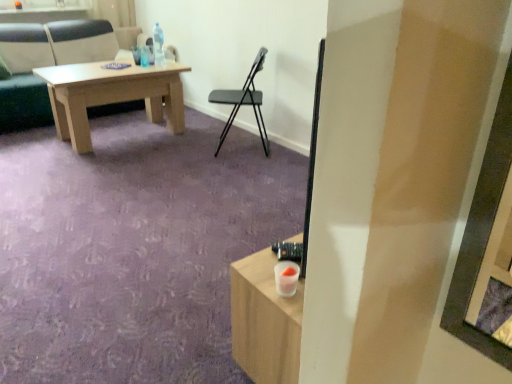
Question: Is black plastic chair at center, which ranks as the first chair in front-to-back order, to the left or to the right of clear plastic bottle at upper center in the image?

Choices:
 (A) right
 (B) left

Answer: (A)

Question: Is black plastic chair at center, placed as the 2th chair when sorted from left to right, situated inside clear plastic bottle at upper center or outside?

Choices:
 (A) outside
 (B) inside

Answer: (A)

Question: Considering the real-world distances, which object is closest to the black plastic chair at center, the second chair in the back-to-front sequence?

Choices:
 (A) light brown wooden table at upper left, which is counted as the first chair, starting from the back
 (B) clear plastic bottle at upper center

Answer: (B)

Question: Which of these objects is positioned farthest from the light brown wooden table at upper left, which is the 2th chair from right to left?

Choices:
 (A) black plastic chair at center, the second chair in the back-to-front sequence
 (B) clear plastic bottle at upper center

Answer: (A)